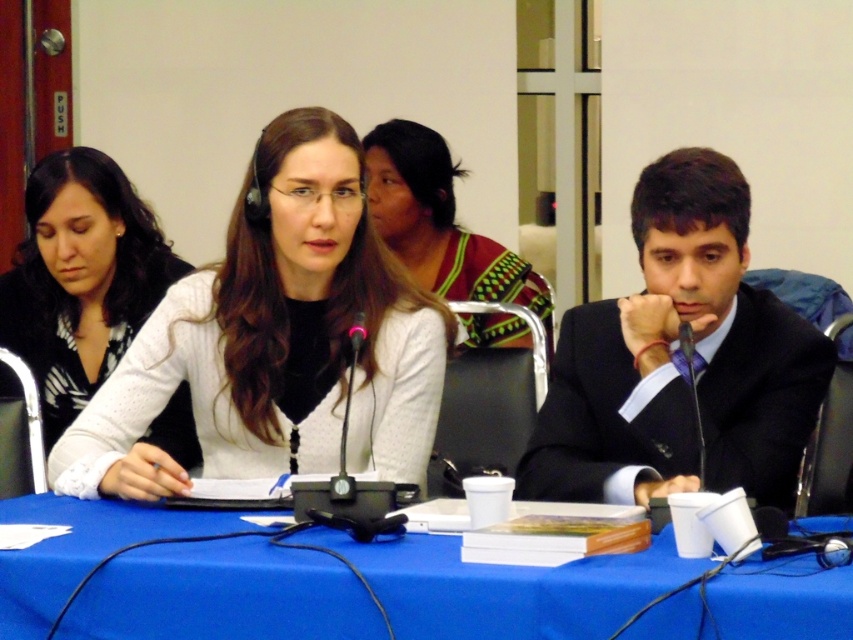
Is white matte sweater at center positioned behind black suit at right?

Yes.

Is white matte sweater at center above black suit at right?

No.

The height and width of the screenshot is (640, 853). Find the location of `white matte sweater at center`. white matte sweater at center is located at coordinates (276, 339).

Is point (247, 592) closer to camera compared to point (418, 147)?

Yes, point (247, 592) is closer to viewer.

Between point (316, 627) and point (471, 241), which one is positioned in front?

Positioned in front is point (316, 627).

Locate an element on the screen. blue fabric table at center is located at coordinates (508, 588).

Can you confirm if white matte sweater at center is positioned below white knit sweater at center?

Indeed, white matte sweater at center is positioned under white knit sweater at center.

Between white matte sweater at center and white knit sweater at center, which one has more height?

With more height is white knit sweater at center.

Is point (351, 237) positioned after point (41, 232)?

No, (351, 237) is in front of (41, 232).

At what (x,y) coordinates should I click in order to perform the action: click on white matte sweater at center. Please return your answer as a coordinate pair (x, y). Looking at the image, I should click on (276, 339).